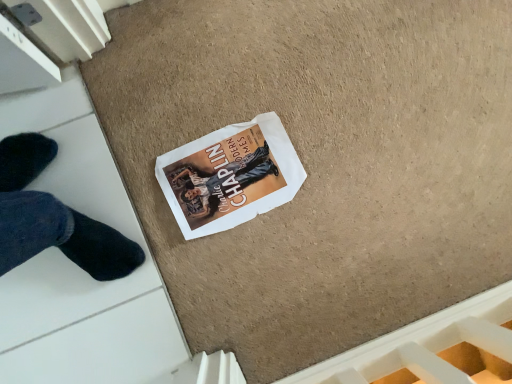
This screenshot has height=384, width=512. I want to click on unoccupied area in front of white paper magazine at center, so click(198, 275).